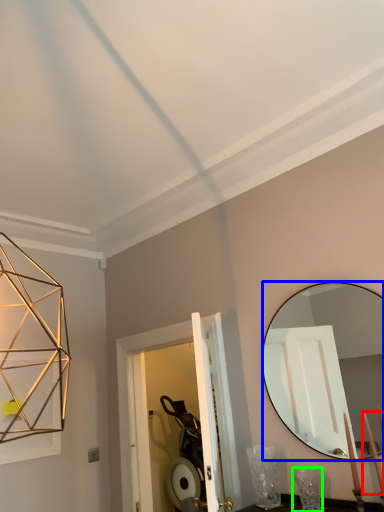
Question: Considering the real-world distances, which object is farthest from candle (highlighted by a red box)? mirror (highlighted by a blue box) or table lamp (highlighted by a green box)?

Choices:
 (A) mirror
 (B) table lamp

Answer: (A)